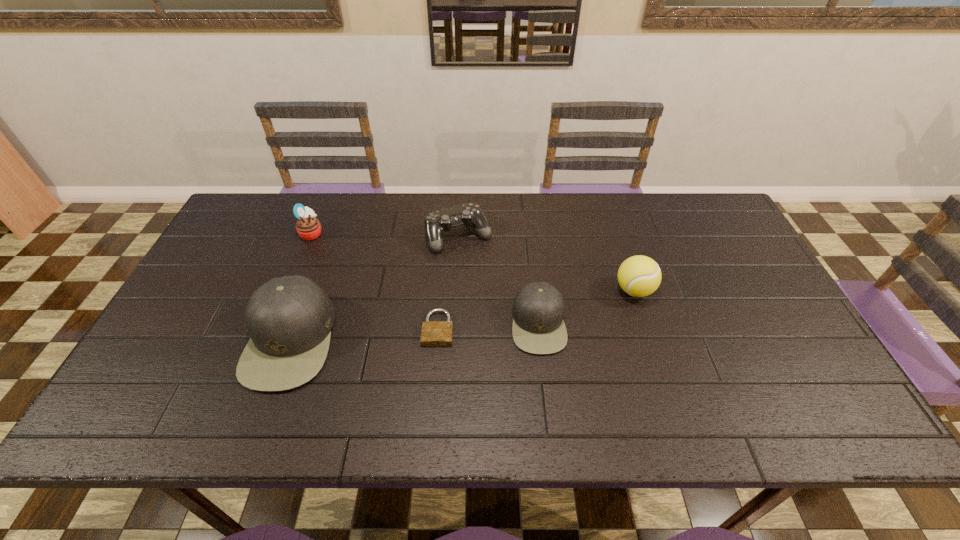
Where is `unoccupied position between the shorter cap and the rightmost object`? The image size is (960, 540). unoccupied position between the shorter cap and the rightmost object is located at coordinates (587, 307).

You are a GUI agent. You are given a task and a screenshot of the screen. Output one action in this format:
    pyautogui.click(x=<x>, y=<y>)
    Task: Click on the empty space that is in between the shortest object and the control
    This screenshot has height=540, width=960.
    Given the screenshot: What is the action you would take?
    pyautogui.click(x=448, y=282)

Locate an element on the screen. The height and width of the screenshot is (540, 960). vacant space that's between the taller cap and the rightmost object is located at coordinates (463, 315).

Identify the location of free space between the padlock and the control. The width and height of the screenshot is (960, 540). (448, 282).

Locate an element on the screen. free point between the shortest object and the control is located at coordinates (448, 282).

At what (x,y) coordinates should I click in order to perform the action: click on free point between the left cap and the tennis ball. Please return your answer as a coordinate pair (x, y). The height and width of the screenshot is (540, 960). Looking at the image, I should click on (463, 315).

The image size is (960, 540). I want to click on object that is the closest to the tallest object, so click(308, 227).

You are a GUI agent. You are given a task and a screenshot of the screen. Output one action in this format:
    pyautogui.click(x=<x>, y=<y>)
    Task: Click on the object that ranks as the fourth closest to the muffin
    
    Given the screenshot: What is the action you would take?
    pyautogui.click(x=538, y=327)

You are a GUI agent. You are given a task and a screenshot of the screen. Output one action in this format:
    pyautogui.click(x=<x>, y=<y>)
    Task: Click on the free point that satisfies the following two spatial constraints: 1. on the front-facing side of the tennis ball; 2. on the left side of the muffin
    
    Given the screenshot: What is the action you would take?
    pyautogui.click(x=288, y=290)

Find the location of a particular element. The height and width of the screenshot is (540, 960). free region that satisfies the following two spatial constraints: 1. on the keyhole side of the padlock; 2. on the brim of the tallest object is located at coordinates (437, 340).